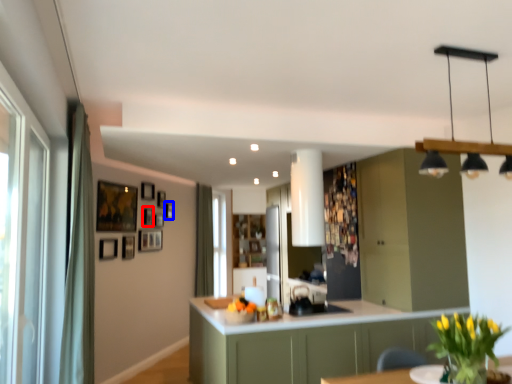
Question: Which object is closer to the camera taking this photo, picture frame (highlighted by a red box) or picture frame (highlighted by a blue box)?

Choices:
 (A) picture frame
 (B) picture frame

Answer: (A)